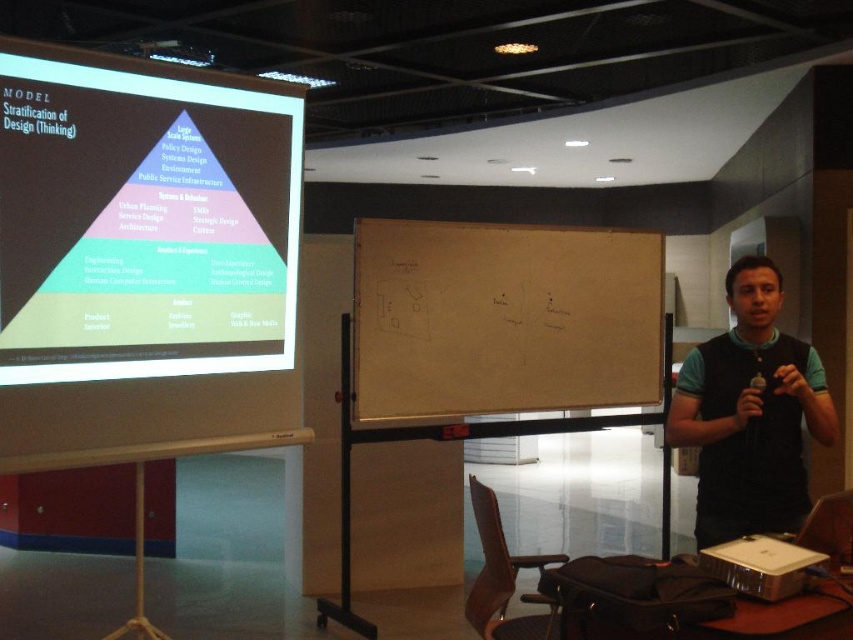
Question: In this image, where is white chalkboard at center located relative to black fabric vest at right?

Choices:
 (A) right
 (B) left

Answer: (B)

Question: Among these points, which one is farthest from the camera?

Choices:
 (A) (758, 324)
 (B) (6, 419)

Answer: (A)

Question: Which object is farther from the camera taking this photo?

Choices:
 (A) matte projector screen at upper left
 (B) white chalkboard at center

Answer: (B)

Question: Among these objects, which one is farthest from the camera?

Choices:
 (A) white chalkboard at center
 (B) black fabric vest at right

Answer: (A)

Question: Does white chalkboard at center have a larger size compared to black fabric vest at right?

Choices:
 (A) no
 (B) yes

Answer: (B)

Question: Does matte projector screen at upper left have a lesser width compared to white chalkboard at center?

Choices:
 (A) no
 (B) yes

Answer: (B)